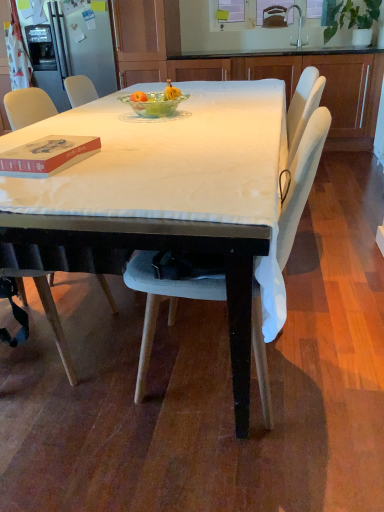
The height and width of the screenshot is (512, 384). In order to click on vacant space to the left of light gray fabric chair at center in this screenshot , I will do `click(79, 385)`.